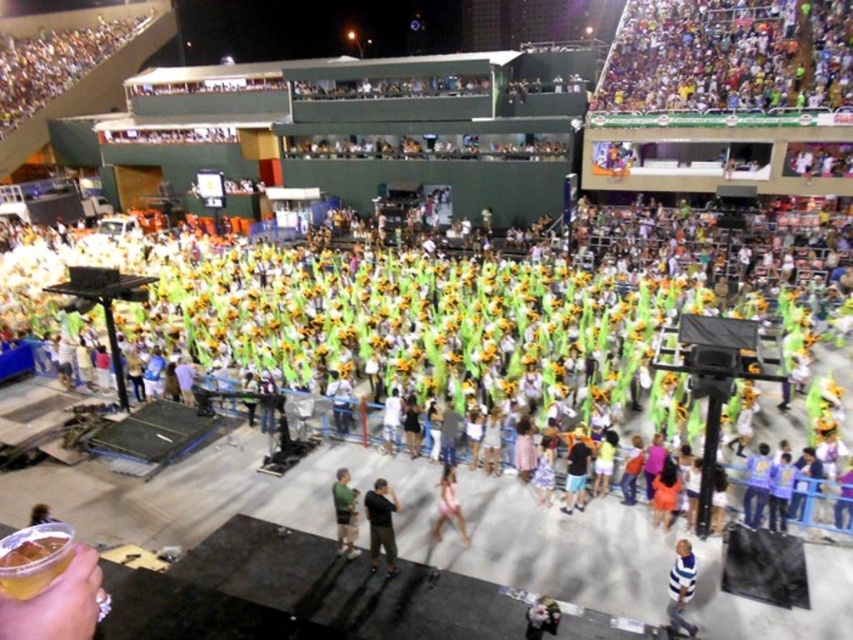
Can you confirm if multicolored fabric crowd at upper right is positioned to the left of green fabric shirt at center?

Incorrect, multicolored fabric crowd at upper right is not on the left side of green fabric shirt at center.

Is multicolored fabric crowd at upper right to the right of green fabric shirt at center from the viewer's perspective?

Yes, multicolored fabric crowd at upper right is to the right of green fabric shirt at center.

Where is `multicolored fabric crowd at upper right`? The width and height of the screenshot is (853, 640). multicolored fabric crowd at upper right is located at coordinates (728, 54).

Between multicolored fabric crowd at upper right and pink fabric dress at center, which one has more height?

With more height is multicolored fabric crowd at upper right.

The width and height of the screenshot is (853, 640). I want to click on multicolored fabric crowd at upper right, so click(728, 54).

At what (x,y) coordinates should I click in order to perform the action: click on multicolored fabric crowd at upper right. Please return your answer as a coordinate pair (x, y). The width and height of the screenshot is (853, 640). Looking at the image, I should click on (728, 54).

Measure the distance between black cotton shorts at center and camera.

black cotton shorts at center and camera are 15.14 meters apart from each other.

You are a GUI agent. You are given a task and a screenshot of the screen. Output one action in this format:
    pyautogui.click(x=<x>, y=<y>)
    Task: Click on the black cotton shorts at center
    The width and height of the screenshot is (853, 640).
    Given the screenshot: What is the action you would take?
    pyautogui.click(x=576, y=472)

Where is `black cotton shorts at center`? black cotton shorts at center is located at coordinates (576, 472).

You are a GUI agent. You are given a task and a screenshot of the screen. Output one action in this format:
    pyautogui.click(x=<x>, y=<y>)
    Task: Click on the black cotton shorts at center
    The image size is (853, 640).
    Given the screenshot: What is the action you would take?
    pyautogui.click(x=576, y=472)